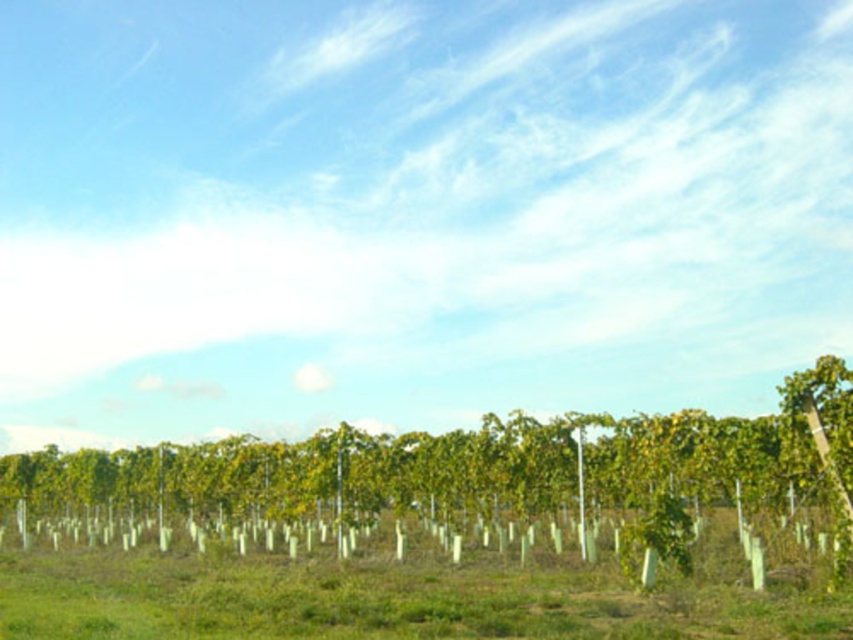
Can you confirm if green leafy tree at center is positioned to the left of green leafy plants at center?

Indeed, green leafy tree at center is positioned on the left side of green leafy plants at center.

Does point (91, 465) lie behind point (3, 596)?

Yes, point (91, 465) is behind point (3, 596).

The height and width of the screenshot is (640, 853). Find the location of `green leafy tree at center`. green leafy tree at center is located at coordinates (482, 467).